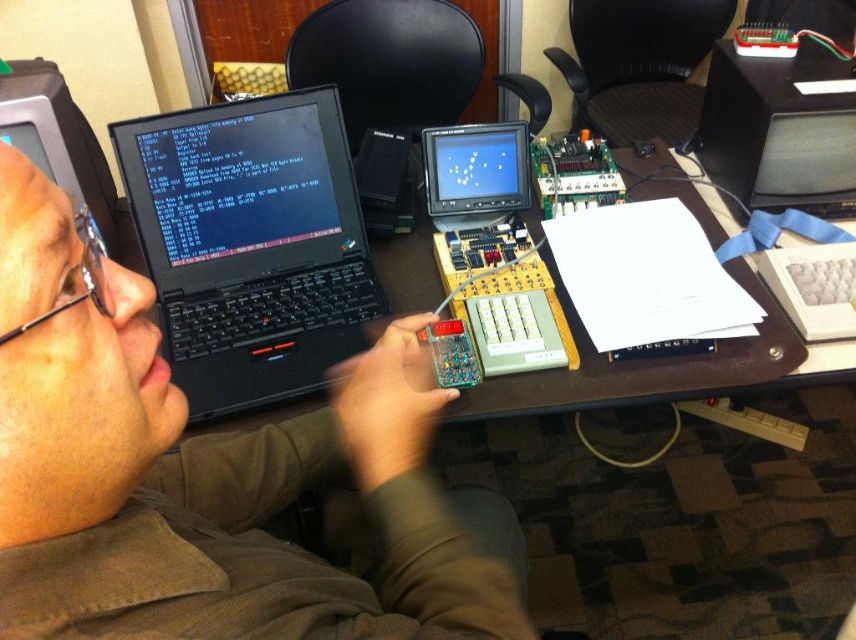
Question: Which of the following is the closest to the observer?

Choices:
 (A) (479, 225)
 (B) (831, 204)

Answer: (A)

Question: Which of the following is the closest to the observer?

Choices:
 (A) matte plastic monitor at center
 (B) black matte laptop at center
 (C) brown wooden table at center
 (D) matte black laptop at upper left

Answer: (D)

Question: Can you confirm if black matte laptop at center is bigger than black plastic monitor at upper right?

Choices:
 (A) no
 (B) yes

Answer: (B)

Question: Does black matte laptop at center have a lesser width compared to matte plastic monitor at center?

Choices:
 (A) yes
 (B) no

Answer: (B)

Question: Which is farther from the brown wooden table at center?

Choices:
 (A) matte black laptop at upper left
 (B) black matte laptop at center

Answer: (A)

Question: Is black matte laptop at center smaller than matte plastic monitor at center?

Choices:
 (A) yes
 (B) no

Answer: (B)